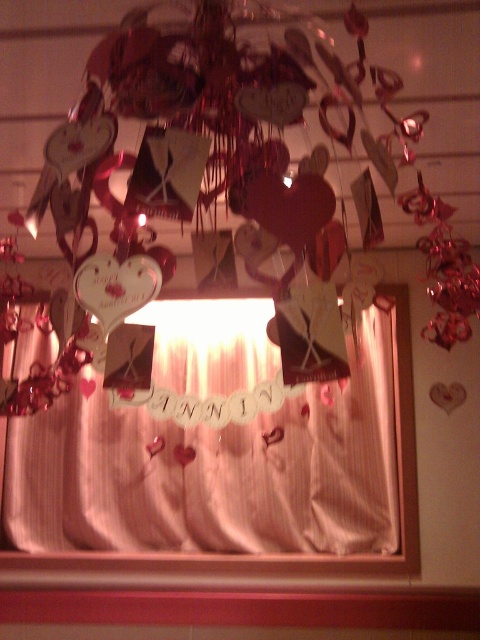
Question: Can you confirm if matte red heart at center is bigger than silky white curtain at center?

Choices:
 (A) yes
 (B) no

Answer: (A)

Question: Which of the following is the closest to the observer?

Choices:
 (A) silky white curtain at center
 (B) matte red heart at center

Answer: (B)

Question: Among these points, which one is nearest to the camera?

Choices:
 (A) (218, 356)
 (B) (199, 86)

Answer: (B)

Question: Which point is closer to the camera?

Choices:
 (A) silky white curtain at center
 (B) matte red heart at center

Answer: (B)

Question: Does matte red heart at center come behind silky white curtain at center?

Choices:
 (A) no
 (B) yes

Answer: (A)

Question: In this image, where is matte red heart at center located relative to silky white curtain at center?

Choices:
 (A) above
 (B) below

Answer: (A)